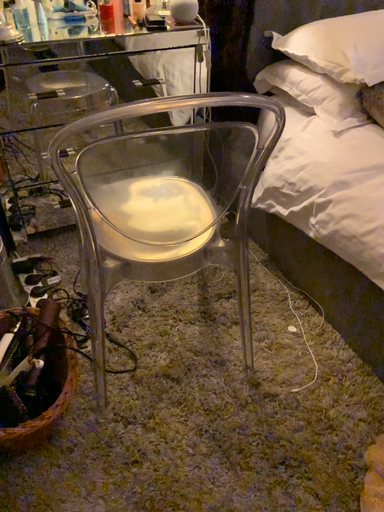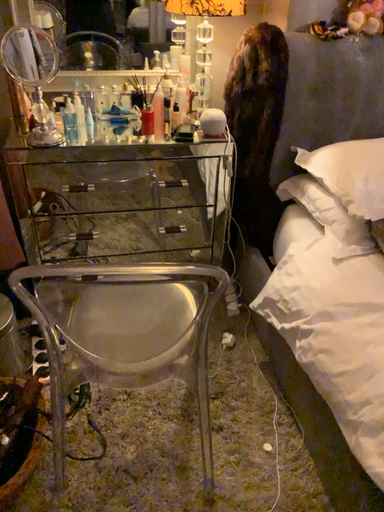
Question: Which way did the camera rotate in the video?

Choices:
 (A) rotated downward
 (B) rotated upward

Answer: (B)